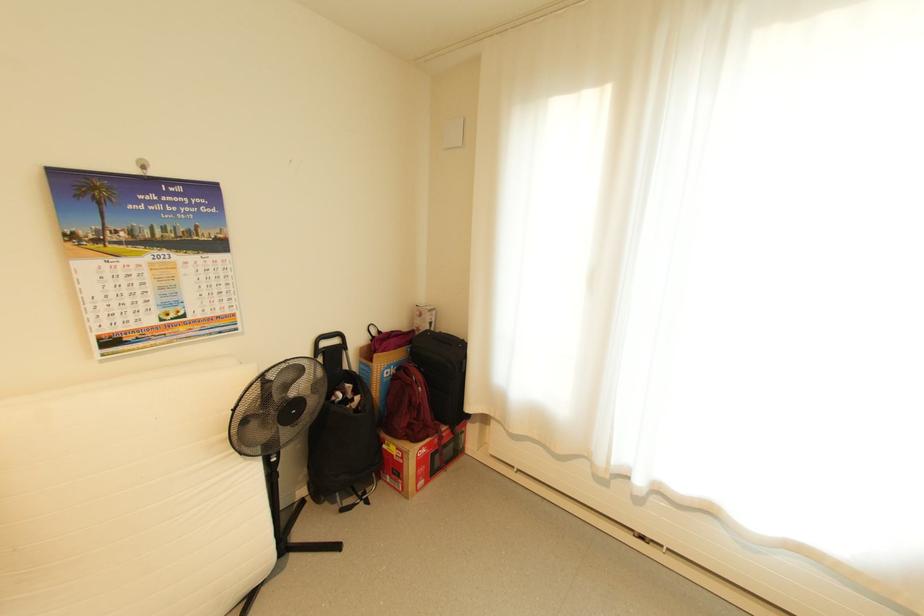
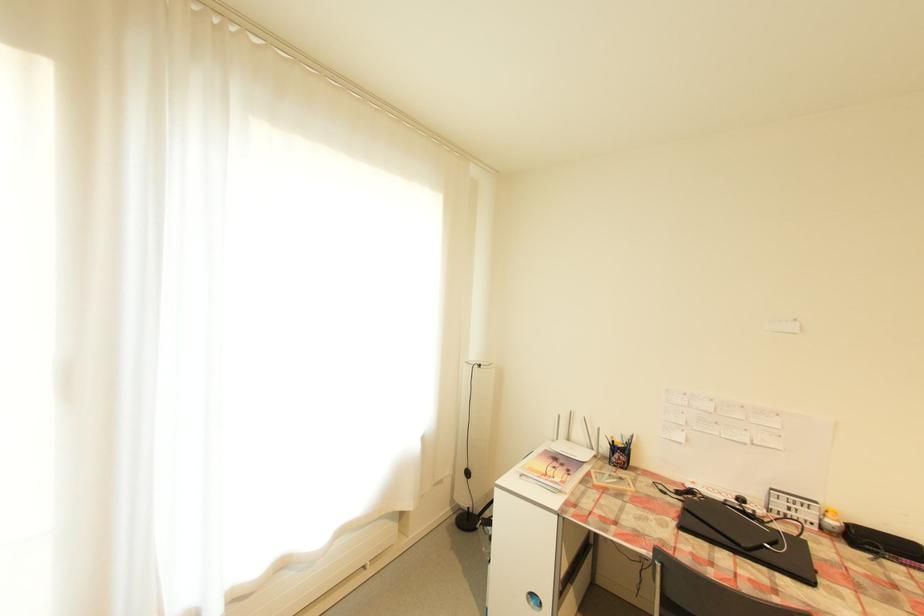
Question: The camera is either moving clockwise (left) or counter-clockwise (right) around the object. The first image is from the beginning of the video and the second image is from the end. Is the camera moving left or right when shooting the video?

Choices:
 (A) Left
 (B) Right

Answer: (A)